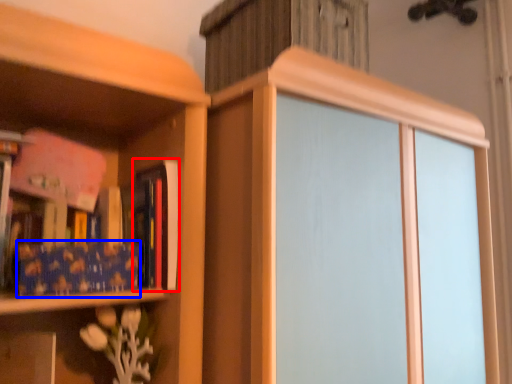
Question: Which point is closer to the camera, book (highlighted by a red box) or paperback book (highlighted by a blue box)?

Choices:
 (A) book
 (B) paperback book

Answer: (B)